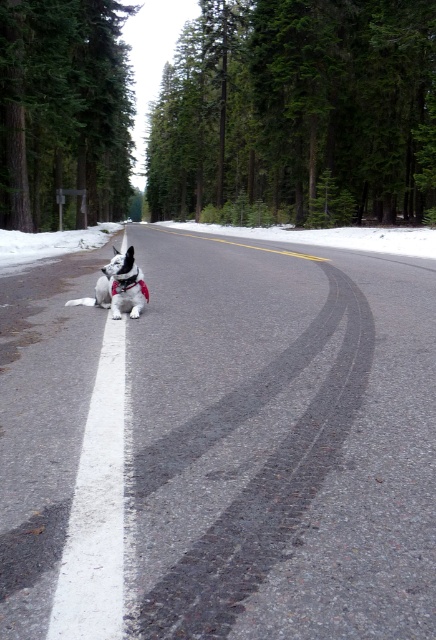
Does white powdery snow at road center have a lesser width compared to white fur dog at center?

Incorrect, white powdery snow at road center's width is not less than white fur dog at center's.

Measure the distance between point (x=397, y=250) and camera.

A distance of 18.86 feet exists between point (x=397, y=250) and camera.

Find the location of a particular element. The image size is (436, 640). white powdery snow at road center is located at coordinates (330, 236).

Does white powdery snow at left have a greater height compared to white fur dog at center?

Yes.

Is white powdery snow at left bigger than white fur dog at center?

Correct, white powdery snow at left is larger in size than white fur dog at center.

Which is in front, point (98, 230) or point (129, 310)?

Point (129, 310) is more forward.

Where is `white powdery snow at left`? The image size is (436, 640). white powdery snow at left is located at coordinates (51, 243).

Is white powdery snow at road center to the left of white powdery snow at left from the viewer's perspective?

In fact, white powdery snow at road center is to the right of white powdery snow at left.

Between white powdery snow at road center and white powdery snow at left, which one has less height?

white powdery snow at left is shorter.

Is point (415, 230) farther from viewer compared to point (54, 253)?

Yes, point (415, 230) is behind point (54, 253).

Find the location of `white powdery snow at road center`. white powdery snow at road center is located at coordinates (330, 236).